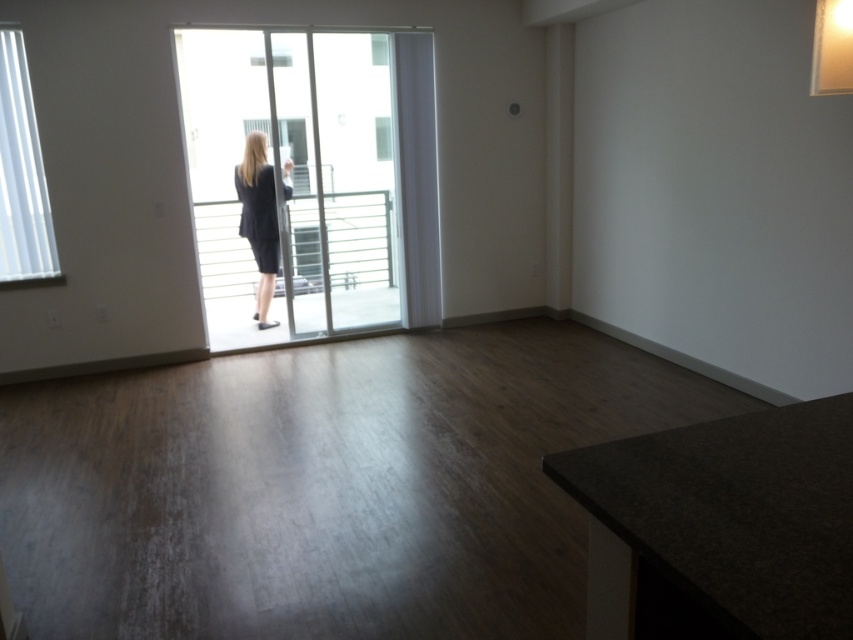
Question: Can you confirm if dark wood countertop at lower right is wider than matte black suit at center?

Choices:
 (A) yes
 (B) no

Answer: (A)

Question: Which point is farther to the camera?

Choices:
 (A) (618, 465)
 (B) (262, 227)
 (C) (277, 232)
 (D) (0, 244)

Answer: (C)

Question: Is clear glass sliding door at center to the left of white frosted glass window at upper left from the viewer's perspective?

Choices:
 (A) yes
 (B) no

Answer: (B)

Question: Can you confirm if clear glass sliding door at center is positioned above dark wood countertop at lower right?

Choices:
 (A) yes
 (B) no

Answer: (A)

Question: Considering the real-world distances, which object is farthest from the dark wood countertop at lower right?

Choices:
 (A) dark gray matte dress at center
 (B) clear glass sliding door at center

Answer: (B)

Question: Which of the following is the closest to the observer?

Choices:
 (A) white frosted glass window at upper left
 (B) clear glass sliding door at center
 (C) matte black suit at center

Answer: (A)